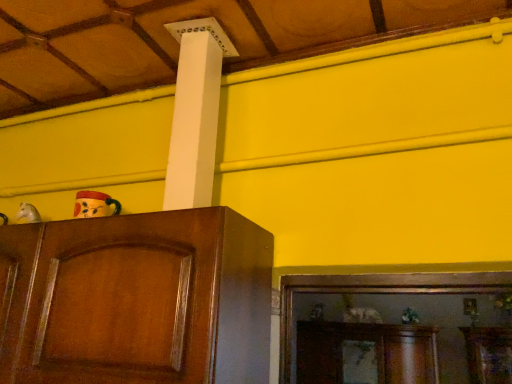
Question: Considering the relative positions of white matte horse head at left, the second toy when ordered from front to back, and shiny brown cabinet at left in the image provided, is white matte horse head at left, the second toy when ordered from front to back, to the left or to the right of shiny brown cabinet at left?

Choices:
 (A) left
 (B) right

Answer: (A)

Question: From the image's perspective, relative to shiny brown cabinet at left, is white matte horse head at left, the first toy viewed from the left, above or below?

Choices:
 (A) above
 (B) below

Answer: (A)

Question: Which object is the closest to the shiny brown cabinet at left?

Choices:
 (A) green matte plant at lower right, the third toy when ordered from top to bottom
 (B) white matte horse head at left, the 2th toy positioned from the top
 (C) matte wooden mask at left, the 1th toy in the top-to-bottom sequence

Answer: (C)

Question: Based on their relative distances, which object is farther from the white matte horse head at left, marked as the 3th toy in a right-to-left arrangement?

Choices:
 (A) green matte plant at lower right, arranged as the third toy when viewed from the front
 (B) shiny brown cabinet at left
 (C) matte wooden mask at left, the 1th toy in the top-to-bottom sequence

Answer: (A)